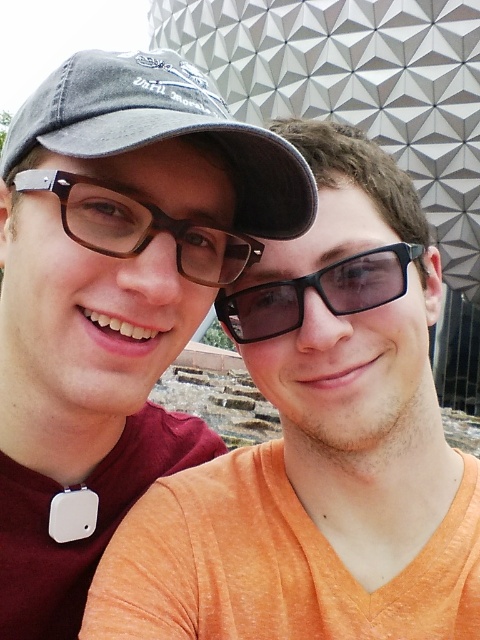
Does matte black glasses at left appear over matte black cap at upper left?

Actually, matte black glasses at left is below matte black cap at upper left.

Is point (192, 554) farther from camera compared to point (115, 292)?

Yes, point (192, 554) is behind point (115, 292).

Locate an element on the screen. matte black glasses at left is located at coordinates [317, 445].

Between matte black glasses at left and denim baseball cap at upper left, which one appears on the right side from the viewer's perspective?

matte black glasses at left

The width and height of the screenshot is (480, 640). I want to click on matte black glasses at left, so click(317, 445).

Is matte black cap at upper left taller than brown matte glasses at center?

Yes.

Between matte black cap at upper left and brown matte glasses at center, which one appears on the right side from the viewer's perspective?

From the viewer's perspective, matte black cap at upper left appears more on the right side.

The image size is (480, 640). In order to click on matte black cap at upper left in this screenshot , I will do `click(113, 298)`.